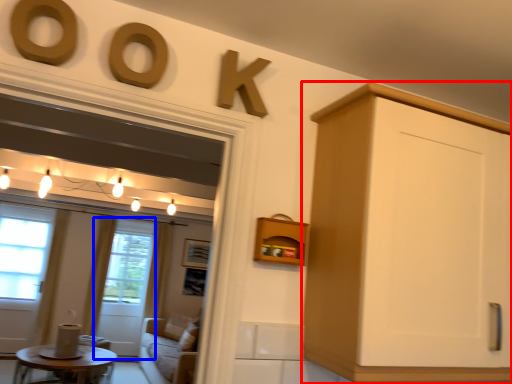
Question: Among these objects, which one is nearest to the camera, cabinetry (highlighted by a red box) or screen door (highlighted by a blue box)?

Choices:
 (A) cabinetry
 (B) screen door

Answer: (A)